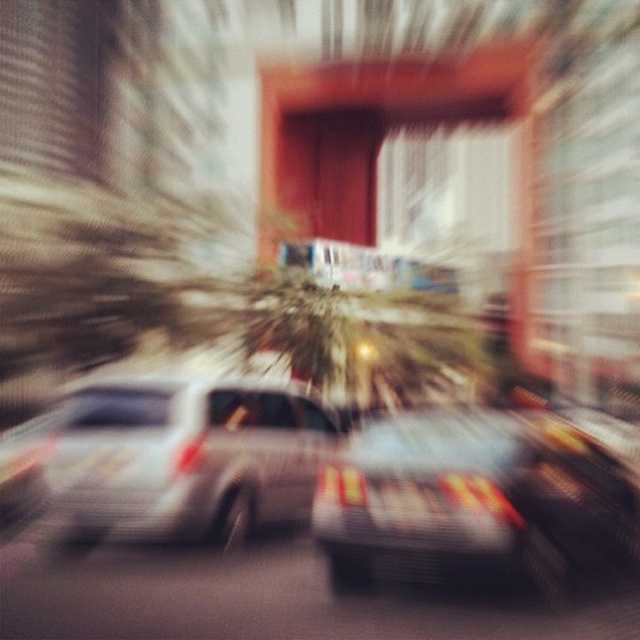
Is metallic silver car at center further to camera compared to metallic gray car at center?

Yes, it is.

In the scene shown: Which is above, metallic silver car at center or metallic gray car at center?

metallic silver car at center is higher up.

Is point (317, 454) in front of point (476, 516)?

No, (317, 454) is behind (476, 516).

This screenshot has height=640, width=640. I want to click on metallic silver car at center, so click(184, 458).